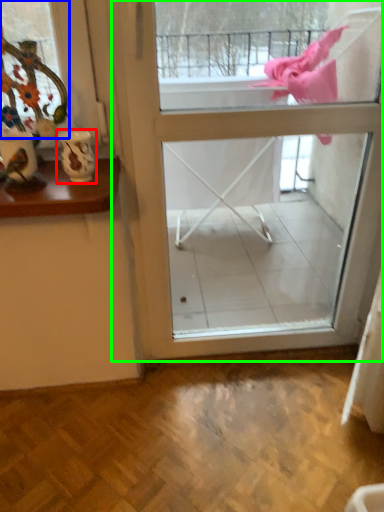
Question: Which object is positioned closest to vase (highlighted by a red box)? Select from window (highlighted by a blue box) and screen door (highlighted by a green box).

Choices:
 (A) window
 (B) screen door

Answer: (A)